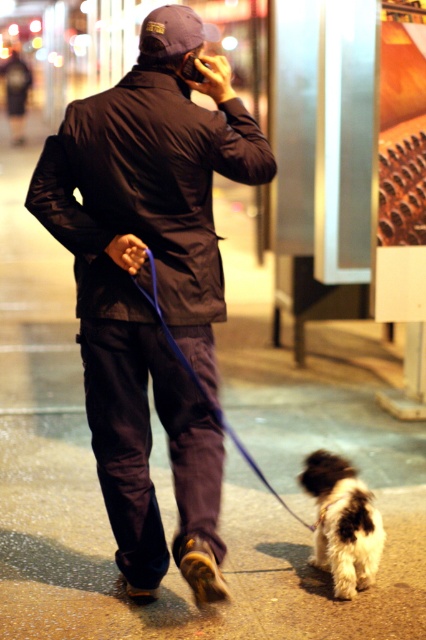
You are a pedestrian trying to cross the street safely. You see the fluffy white dog at lower right and the blue fabric leash at lower center in your path. Which object is closer to you?

The fluffy white dog at lower right is closer to you since it is smaller in size compared to the blue fabric leash at lower center, indicating it is nearer.

Looking at this image, you are a delivery drone flying over the nighttime urban scene. You need to land at a specific point. The coordinates for the landing zone are either point 1 at point (348, 573) or point 2 at point (204, 388). According to the scene description, which point is closer to the man walking the dog?

Point 2 at point (204, 388) is closer to the man walking the dog because point 1 at point (348, 573) is behind point 2.

You are a pedestrian trying to cross the street safely. You see the matte black jacket at center and the fluffy white dog at lower right in your line of sight. Which object is closer to the ground?

The fluffy white dog at lower right is closer to the ground because the matte black jacket at center is above it.